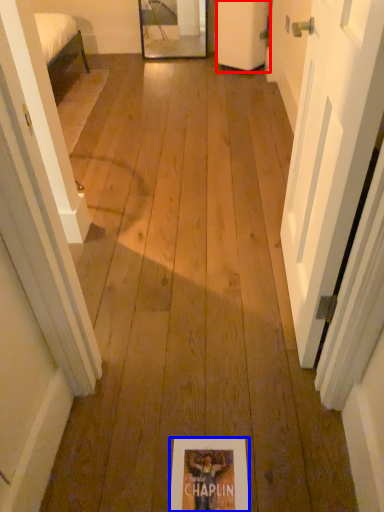
Question: Among these objects, which one is nearest to the camera, door (highlighted by a red box) or flyer (highlighted by a blue box)?

Choices:
 (A) door
 (B) flyer

Answer: (B)